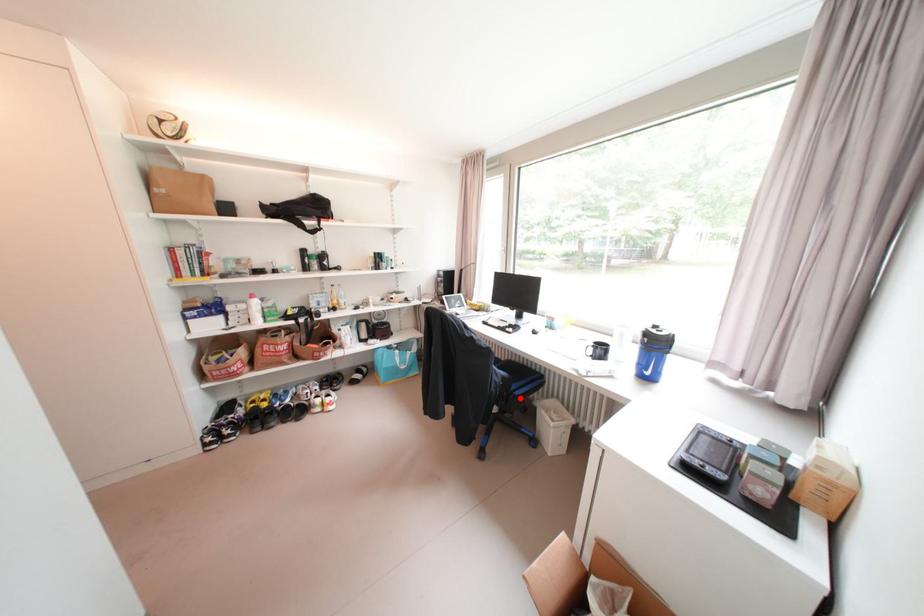
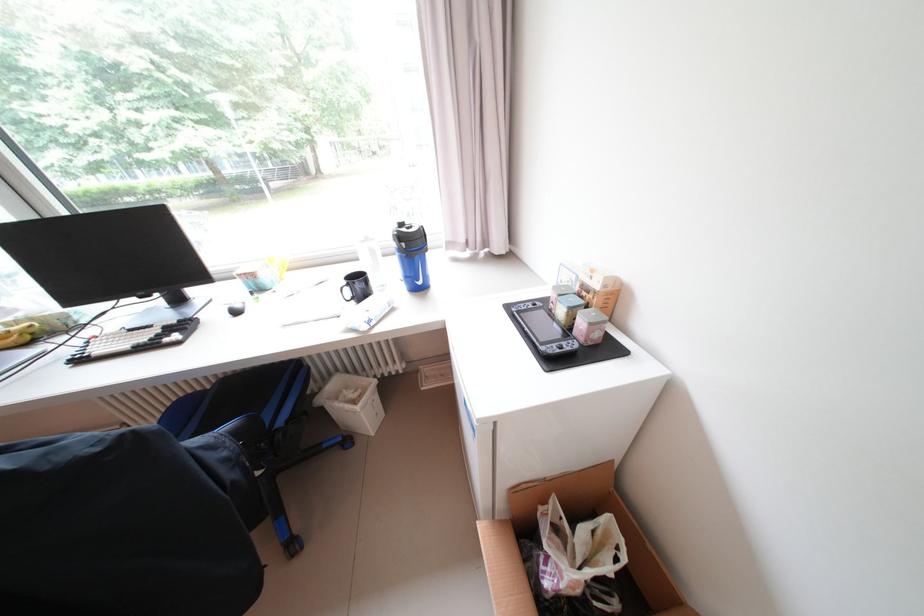
Question: I am providing you with two images of the same scene from different viewpoints. A red point is shown in image1. For the corresponding object point in image2, is it positioned nearer or farther from the camera?

Choices:
 (A) Nearer
 (B) Farther

Answer: (A)